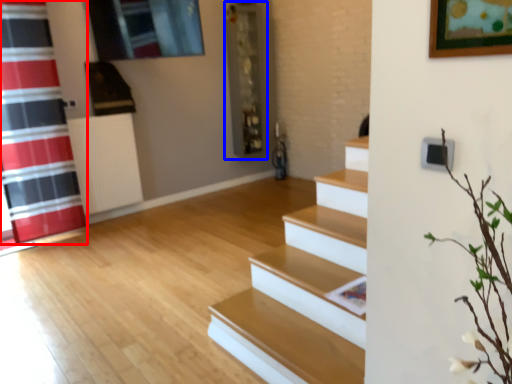
Question: Which point is closer to the camera, shower curtain (highlighted by a red box) or shelf (highlighted by a blue box)?

Choices:
 (A) shower curtain
 (B) shelf

Answer: (A)